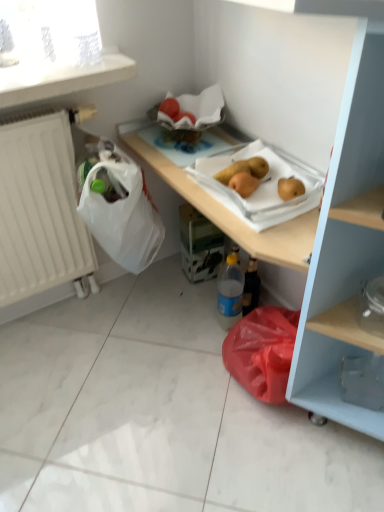
Locate an element on the screen. Image resolution: width=384 pixels, height=512 pixels. vacant space to the right of white matte radiator at left is located at coordinates (151, 311).